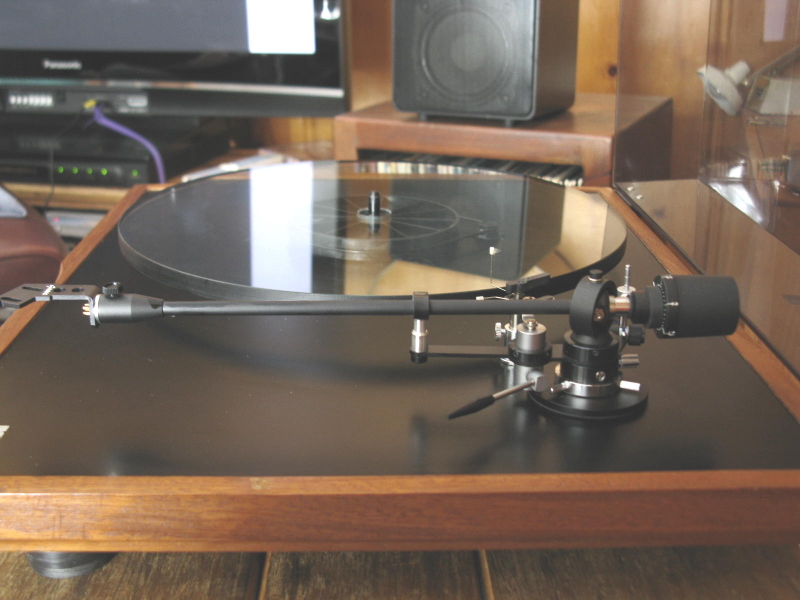
The height and width of the screenshot is (600, 800). What are the coordinates of `lamp` in the screenshot? It's located at (725, 79).